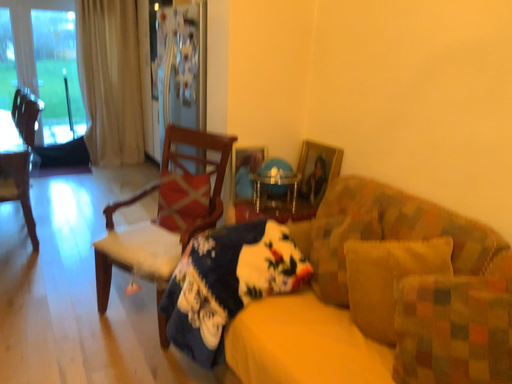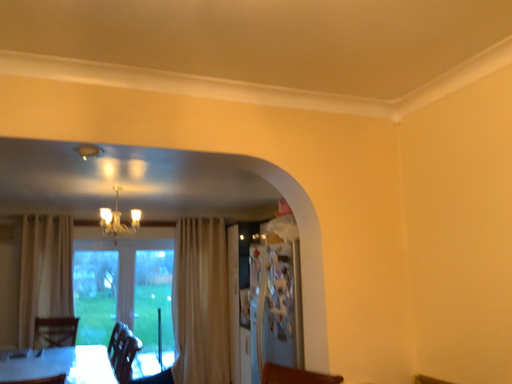
Question: How did the camera likely rotate when shooting the video?

Choices:
 (A) rotated right
 (B) rotated left

Answer: (B)